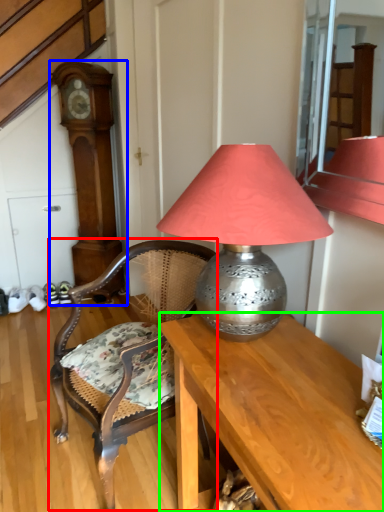
Question: Which object is positioned closest to chair (highlighted by a red box)? Select from clock (highlighted by a blue box) and desk (highlighted by a green box).

Choices:
 (A) clock
 (B) desk

Answer: (B)